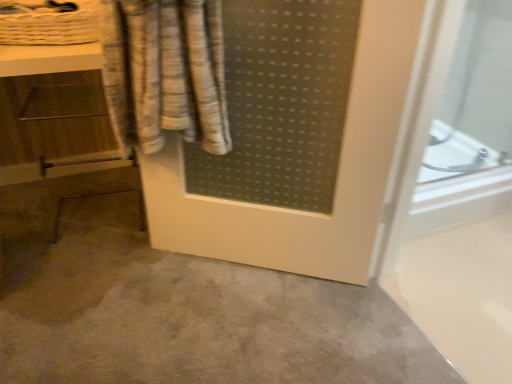
Question: Considering the relative sizes of gray matte concrete at center and white woven basket at upper left in the image provided, is gray matte concrete at center taller than white woven basket at upper left?

Choices:
 (A) no
 (B) yes

Answer: (A)

Question: Is gray matte concrete at center oriented away from white woven basket at upper left?

Choices:
 (A) no
 (B) yes

Answer: (A)

Question: From a real-world perspective, is gray matte concrete at center physically below white woven basket at upper left?

Choices:
 (A) yes
 (B) no

Answer: (A)

Question: Considering the relative sizes of gray matte concrete at center and white woven basket at upper left in the image provided, is gray matte concrete at center thinner than white woven basket at upper left?

Choices:
 (A) no
 (B) yes

Answer: (A)

Question: Could you tell me if gray matte concrete at center is turned towards white woven basket at upper left?

Choices:
 (A) yes
 (B) no

Answer: (B)

Question: Is point (79, 21) positioned closer to the camera than point (68, 134)?

Choices:
 (A) closer
 (B) farther

Answer: (A)

Question: Considering the positions of white woven basket at upper left and wooden vanity at left in the image, is white woven basket at upper left bigger or smaller than wooden vanity at left?

Choices:
 (A) big
 (B) small

Answer: (B)

Question: In terms of width, does white woven basket at upper left look wider or thinner when compared to wooden vanity at left?

Choices:
 (A) thin
 (B) wide

Answer: (A)

Question: From the image's perspective, relative to wooden vanity at left, is white woven basket at upper left above or below?

Choices:
 (A) above
 (B) below

Answer: (A)

Question: Relative to gray matte concrete at center, is wooden vanity at left in front or behind?

Choices:
 (A) behind
 (B) front

Answer: (A)

Question: Is wooden vanity at left to the left or to the right of gray matte concrete at center in the image?

Choices:
 (A) right
 (B) left

Answer: (B)

Question: From the image's perspective, relative to gray matte concrete at center, is wooden vanity at left above or below?

Choices:
 (A) above
 (B) below

Answer: (A)

Question: Do you think wooden vanity at left is within gray matte concrete at center, or outside of it?

Choices:
 (A) inside
 (B) outside

Answer: (B)

Question: Considering the relative positions of gray matte concrete at center and white woven basket at upper left in the image provided, is gray matte concrete at center to the left or to the right of white woven basket at upper left?

Choices:
 (A) left
 (B) right

Answer: (B)

Question: In terms of height, does gray matte concrete at center look taller or shorter compared to white woven basket at upper left?

Choices:
 (A) short
 (B) tall

Answer: (A)